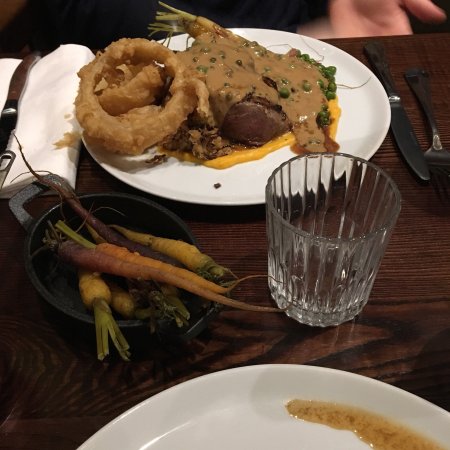
Where is `fork`? The image size is (450, 450). fork is located at coordinates (420, 93).